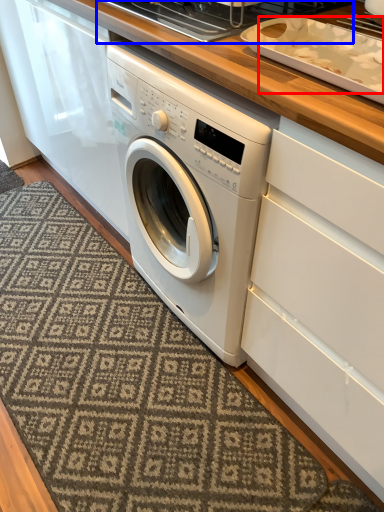
Question: Which object is further to the camera taking this photo, food (highlighted by a red box) or appliance (highlighted by a blue box)?

Choices:
 (A) food
 (B) appliance

Answer: (B)